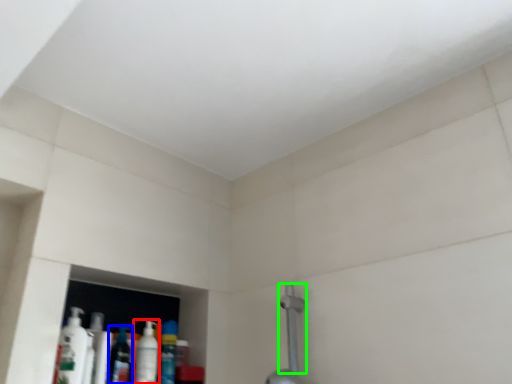
Question: Based on their relative distances, which object is nearer to mouthwash (highlighted by a red box)? Choose from mouthwash (highlighted by a blue box) and shower (highlighted by a green box).

Choices:
 (A) mouthwash
 (B) shower

Answer: (A)